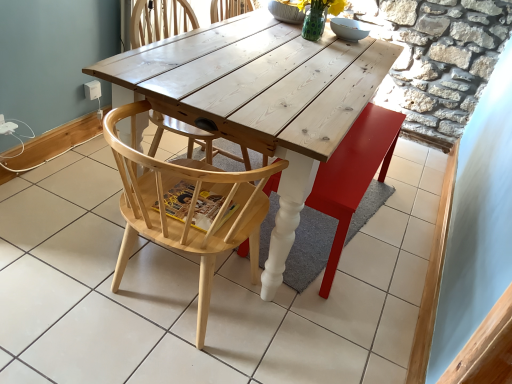
Question: Does point (385, 168) appear closer or farther from the camera than point (246, 195)?

Choices:
 (A) farther
 (B) closer

Answer: (A)

Question: Relative to natural wood chair at center, the 1th chair viewed from the front, is wooden swivel chair at center in front or behind?

Choices:
 (A) front
 (B) behind

Answer: (B)

Question: Considering the real-world distances, which object is farthest from the white wood table at center?

Choices:
 (A) natural wood chair at center, which is the second chair in front-to-back order
 (B) natural wood chair at center, the 1th chair viewed from the front
 (C) wooden swivel chair at center

Answer: (A)

Question: Estimate the real-world distances between objects in this image. Which object is closer to the wooden swivel chair at center?

Choices:
 (A) natural wood chair at center, which is counted as the 2th chair, starting from the back
 (B) natural wood chair at center, which is the second chair in front-to-back order
 (C) white wood table at center

Answer: (A)